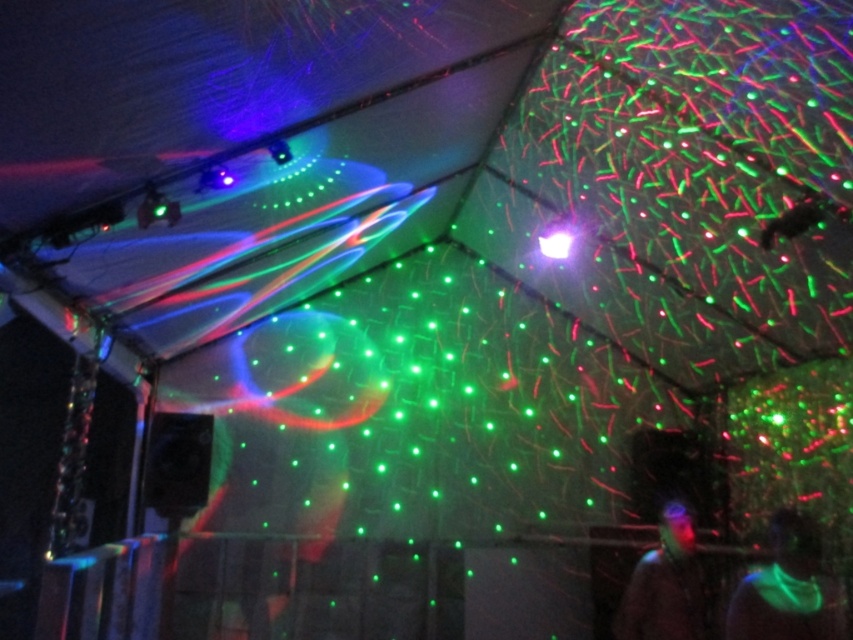
Between neon green glowing vest at lower right and translucent plastic head at center, which one appears on the left side from the viewer's perspective?

From the viewer's perspective, translucent plastic head at center appears more on the left side.

Is neon green glowing vest at lower right wider than translucent plastic head at center?

Yes.

This screenshot has height=640, width=853. I want to click on neon green glowing vest at lower right, so click(x=786, y=588).